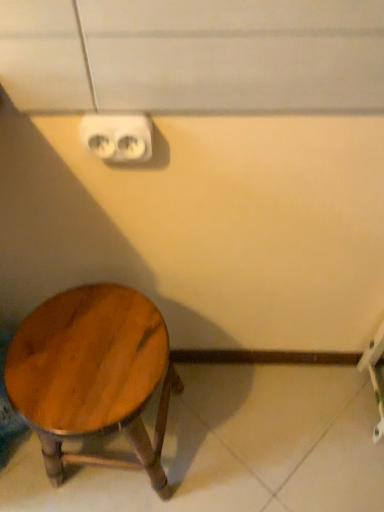
Question: From their relative heights in the image, would you say white plastic outlet at upper center is taller or shorter than shiny brown wood stool at lower left?

Choices:
 (A) short
 (B) tall

Answer: (A)

Question: Considering the positions of point (135, 159) and point (48, 348), is point (135, 159) closer or farther from the camera than point (48, 348)?

Choices:
 (A) closer
 (B) farther

Answer: (A)

Question: Looking at the image, does white plastic outlet at upper center seem bigger or smaller compared to shiny brown wood stool at lower left?

Choices:
 (A) small
 (B) big

Answer: (A)

Question: From a real-world perspective, is shiny brown wood stool at lower left above or below white plastic outlet at upper center?

Choices:
 (A) below
 (B) above

Answer: (A)

Question: Is shiny brown wood stool at lower left taller or shorter than white plastic outlet at upper center?

Choices:
 (A) tall
 (B) short

Answer: (A)

Question: Considering the positions of shiny brown wood stool at lower left and white plastic outlet at upper center in the image, is shiny brown wood stool at lower left wider or thinner than white plastic outlet at upper center?

Choices:
 (A) thin
 (B) wide

Answer: (B)

Question: From the image's perspective, relative to white plastic outlet at upper center, is shiny brown wood stool at lower left above or below?

Choices:
 (A) above
 (B) below

Answer: (B)